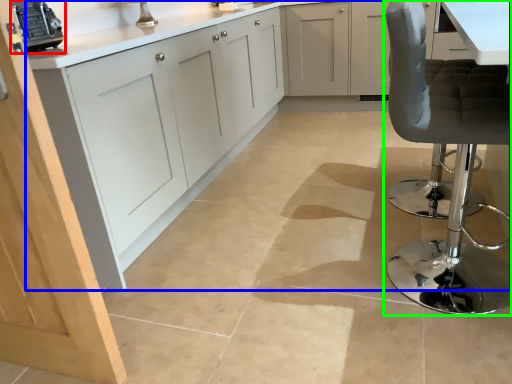
Question: Considering the real-world distances, which object is closest to appliance (highlighted by a red box)? cabinetry (highlighted by a blue box) or chair (highlighted by a green box).

Choices:
 (A) cabinetry
 (B) chair

Answer: (A)